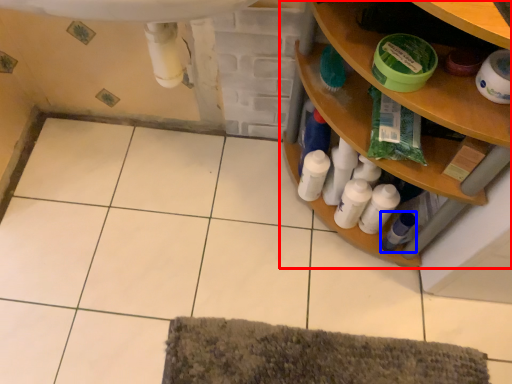
Question: Which of the following is the farthest to the observer, shelf (highlighted by a red box) or toiletry (highlighted by a blue box)?

Choices:
 (A) shelf
 (B) toiletry

Answer: (B)